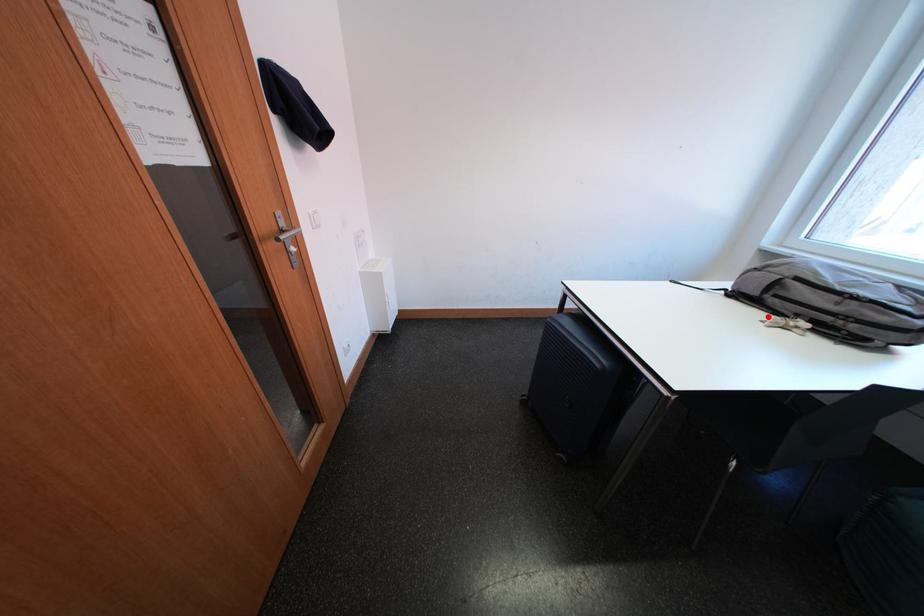
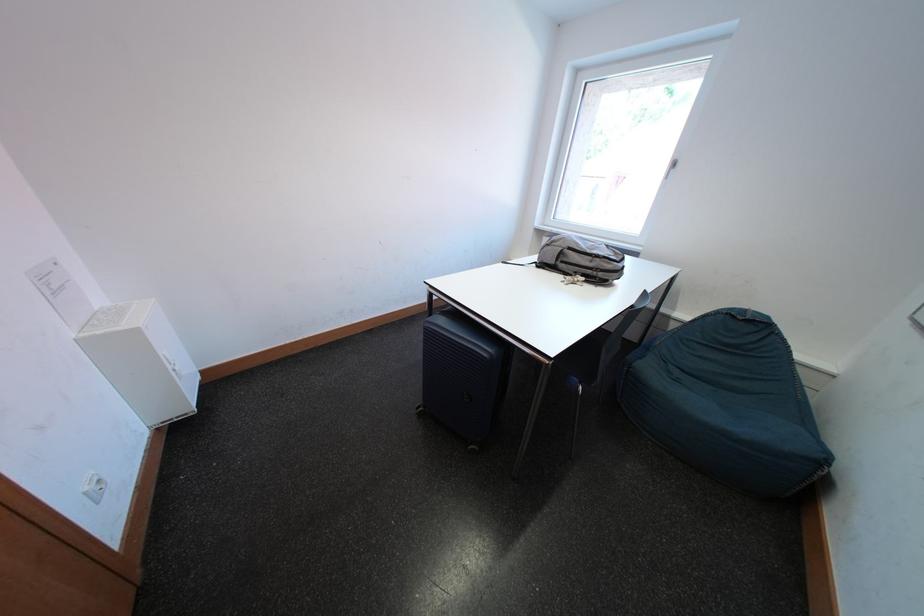
Find the pixel in the second image that matches the highlighted location in the first image.

(569, 280)